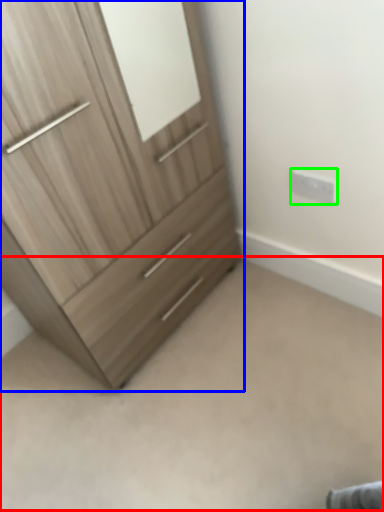
Question: Considering the real-world distances, which object is farthest from plain (highlighted by a red box)? chest of drawers (highlighted by a blue box) or electric outlet (highlighted by a green box)?

Choices:
 (A) chest of drawers
 (B) electric outlet

Answer: (B)